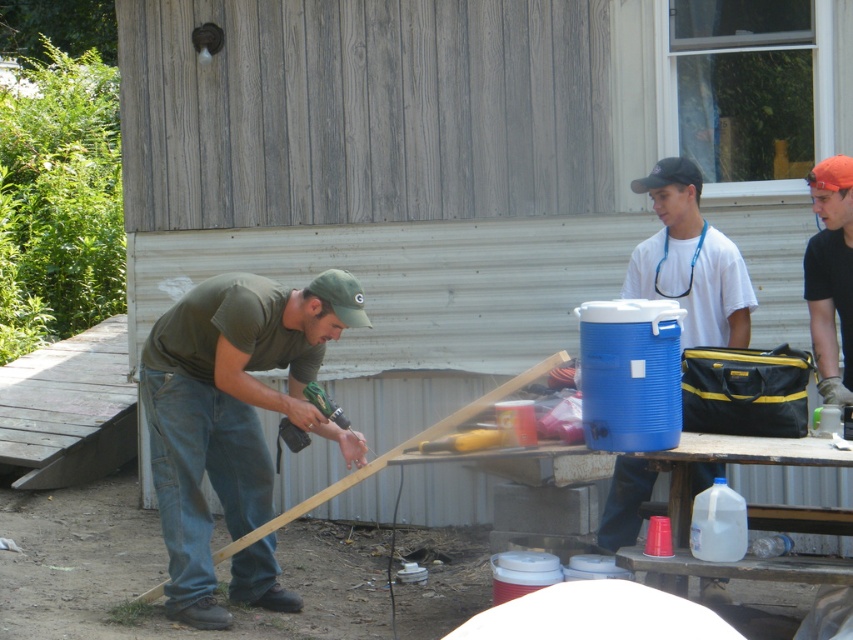
You are standing in the outdoor scene and want to determine which of the two points, point (194,388) or point (811,289), is closer to you. Which one should you choose?

Point (194,388) is closer to the viewer than point (811,289), so you should choose point (194,388).

You are standing at the origin point of the coordinate system. There is a point marked at coordinate (231,410). What object is located at that point?

The point at coordinate (231,410) corresponds to the green matte shirt at center.

You are a delivery person who needs to place a 1.5 meter long package between the green matte shirt at center and the white matte cooler at center. Is there enough space to fit the package without moving either object?

The distance between the green matte shirt at center and the white matte cooler at center is 1.65 meters. Since the package is 1.5 meters long, there is enough space to fit it between them without moving either object.